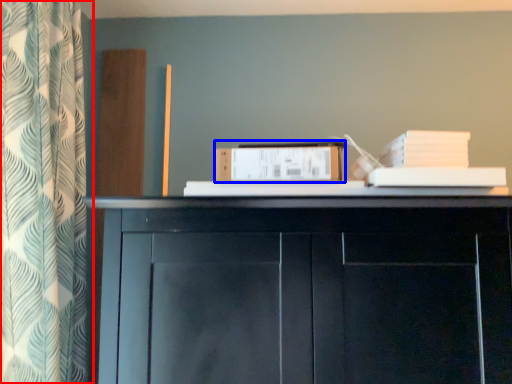
Question: Among these objects, which one is nearest to the camera, curtain (highlighted by a red box) or paperback book (highlighted by a blue box)?

Choices:
 (A) curtain
 (B) paperback book

Answer: (A)